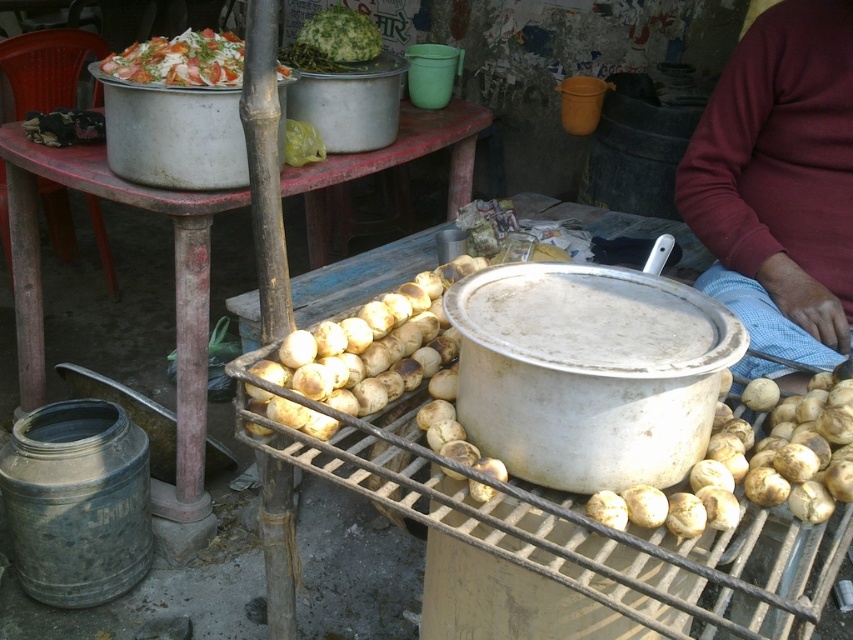
Which is below, wooden table at center or brown matte potatoes at center?

brown matte potatoes at center is below.

Is point (308, 228) farther from viewer compared to point (347, 376)?

Yes, point (308, 228) is behind point (347, 376).

Find the location of a particular element. The image size is (853, 640). wooden table at center is located at coordinates (173, 291).

Between brown matte potatoes at center and white creamy salad at upper left, which one appears on the right side from the viewer's perspective?

brown matte potatoes at center

Does point (285, 355) lie behind point (183, 61)?

No, (285, 355) is closer to viewer.

What do you see at coordinates (370, 342) in the screenshot?
I see `brown matte potatoes at center` at bounding box center [370, 342].

You are a GUI agent. You are given a task and a screenshot of the screen. Output one action in this format:
    pyautogui.click(x=<x>, y=<y>)
    Task: Click on the brown matte potatoes at center
    
    Given the screenshot: What is the action you would take?
    pyautogui.click(x=370, y=342)

Who is taller, wooden table at center or white matte potatoes at center?

Standing taller between the two is wooden table at center.

Is the position of wooden table at center more distant than that of white matte potatoes at center?

Yes, it is.

You are a GUI agent. You are given a task and a screenshot of the screen. Output one action in this format:
    pyautogui.click(x=<x>, y=<y>)
    Task: Click on the wooden table at center
    This screenshot has height=640, width=853.
    Given the screenshot: What is the action you would take?
    pyautogui.click(x=173, y=291)